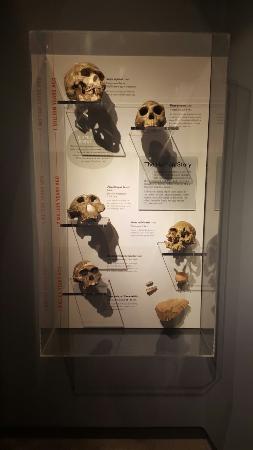
The width and height of the screenshot is (253, 450). What are the coordinates of `floor` in the screenshot? It's located at (149, 444).